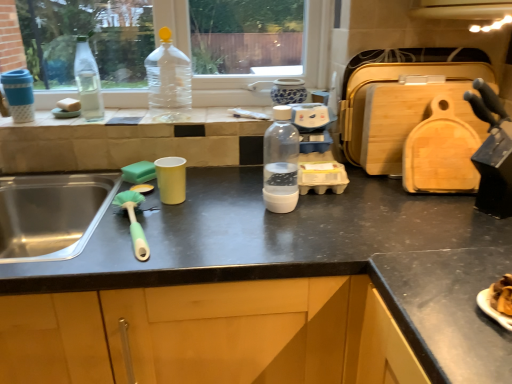
Question: Considering the relative sizes of green plastic brush at left and clear glass bottle at left, which is the third bottle in front-to-back order, in the image provided, is green plastic brush at left smaller than clear glass bottle at left, which is the third bottle in front-to-back order,?

Choices:
 (A) yes
 (B) no

Answer: (B)

Question: Does green plastic brush at left touch clear glass bottle at left, which is the third bottle from right to left?

Choices:
 (A) yes
 (B) no

Answer: (B)

Question: Is green plastic brush at left oriented away from clear glass bottle at left, which is the third bottle in front-to-back order?

Choices:
 (A) yes
 (B) no

Answer: (B)

Question: Can we say green plastic brush at left lies outside clear glass bottle at left, which is the third bottle from right to left?

Choices:
 (A) yes
 (B) no

Answer: (A)

Question: Can clear glass bottle at left, which is the third bottle from right to left, be found inside green plastic brush at left?

Choices:
 (A) yes
 (B) no

Answer: (B)

Question: Visually, is clear glass bottle at left, which is the third bottle from right to left, positioned to the left or to the right of green sponge at left, the 1th food from the bottom?

Choices:
 (A) left
 (B) right

Answer: (A)

Question: Considering the positions of point (98, 114) and point (121, 172), is point (98, 114) closer or farther from the camera than point (121, 172)?

Choices:
 (A) farther
 (B) closer

Answer: (A)

Question: Is clear glass bottle at left, which is the third bottle in front-to-back order, taller or shorter than green sponge at left, marked as the first food in a front-to-back arrangement?

Choices:
 (A) tall
 (B) short

Answer: (A)

Question: Is clear glass bottle at left, which is counted as the 1th bottle, starting from the left, inside the boundaries of green sponge at left, arranged as the first food when viewed from the right, or outside?

Choices:
 (A) outside
 (B) inside

Answer: (A)

Question: Is point (114, 198) positioned closer to the camera than point (36, 122)?

Choices:
 (A) closer
 (B) farther

Answer: (A)

Question: Considering the relative positions of green plastic brush at left and translucent glass bottle at upper center in the image provided, is green plastic brush at left to the left or to the right of translucent glass bottle at upper center?

Choices:
 (A) left
 (B) right

Answer: (B)

Question: From the image's perspective, is green plastic brush at left positioned above or below translucent glass bottle at upper center?

Choices:
 (A) below
 (B) above

Answer: (A)

Question: Is green plastic brush at left in front of or behind translucent glass bottle at upper center in the image?

Choices:
 (A) behind
 (B) front

Answer: (B)

Question: From a real-world perspective, is green plastic brush at left physically located above or below matte black countertop at center?

Choices:
 (A) above
 (B) below

Answer: (A)

Question: From the image's perspective, is green plastic brush at left positioned above or below matte black countertop at center?

Choices:
 (A) below
 (B) above

Answer: (B)